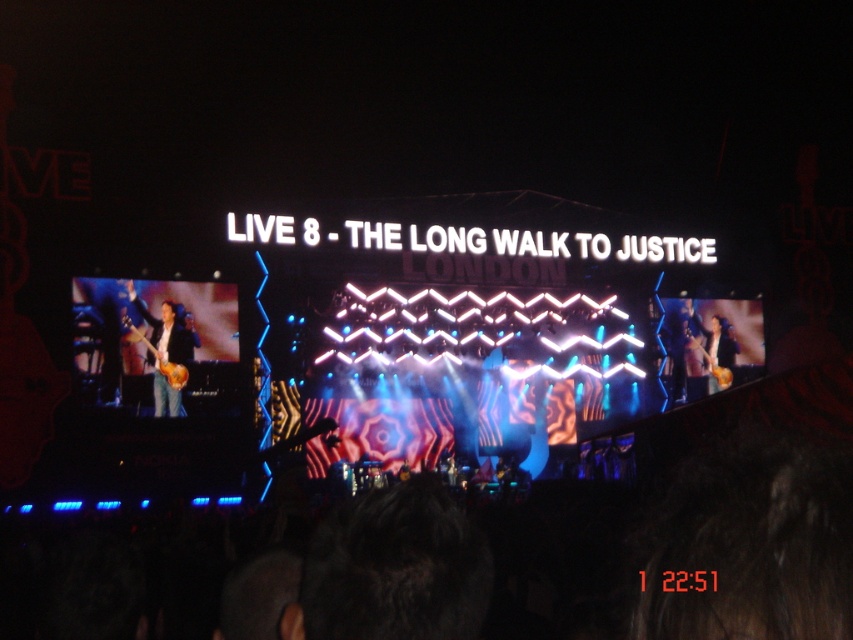
In the scene shown: Does matte brown guitar at left appear under glossy wood guitar at right?

Actually, matte brown guitar at left is above glossy wood guitar at right.

Between point (178, 385) and point (728, 384), which one is positioned behind?

The point (728, 384) is behind.

I want to click on matte brown guitar at left, so [165, 349].

Can you confirm if matte brown guitar at right is smaller than glossy wood guitar at center?

Incorrect, matte brown guitar at right is not smaller in size than glossy wood guitar at center.

How far apart are matte brown guitar at right and glossy wood guitar at center?

matte brown guitar at right is 64.97 meters from glossy wood guitar at center.

Who is more distant from viewer, (722,355) or (158,369)?

Positioned behind is point (722,355).

The height and width of the screenshot is (640, 853). Identify the location of matte brown guitar at right. (718, 353).

Is point (152, 333) behind point (712, 381)?

No, it is in front of (712, 381).

Image resolution: width=853 pixels, height=640 pixels. In order to click on matte brown guitar at left in this screenshot , I will do `click(165, 349)`.